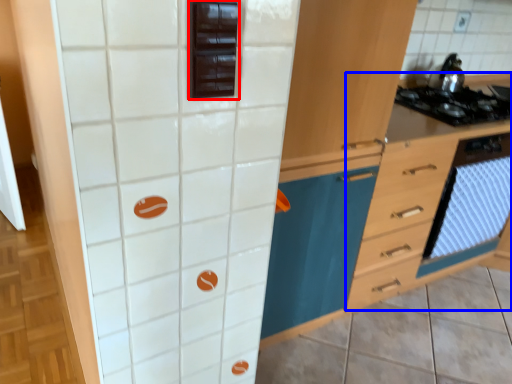
Question: Which of the following is the farthest to the observer, appliance (highlighted by a red box) or file cabinet (highlighted by a blue box)?

Choices:
 (A) appliance
 (B) file cabinet

Answer: (B)